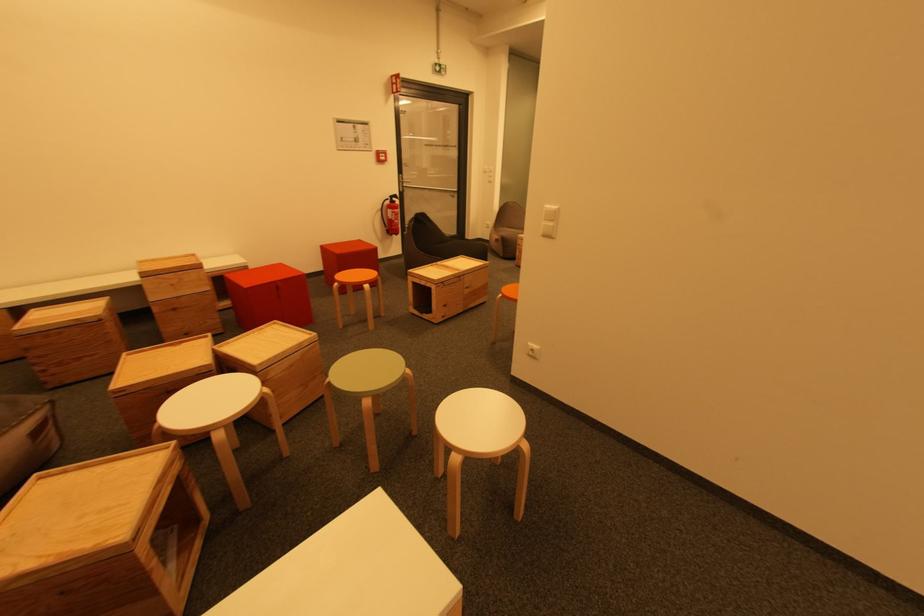
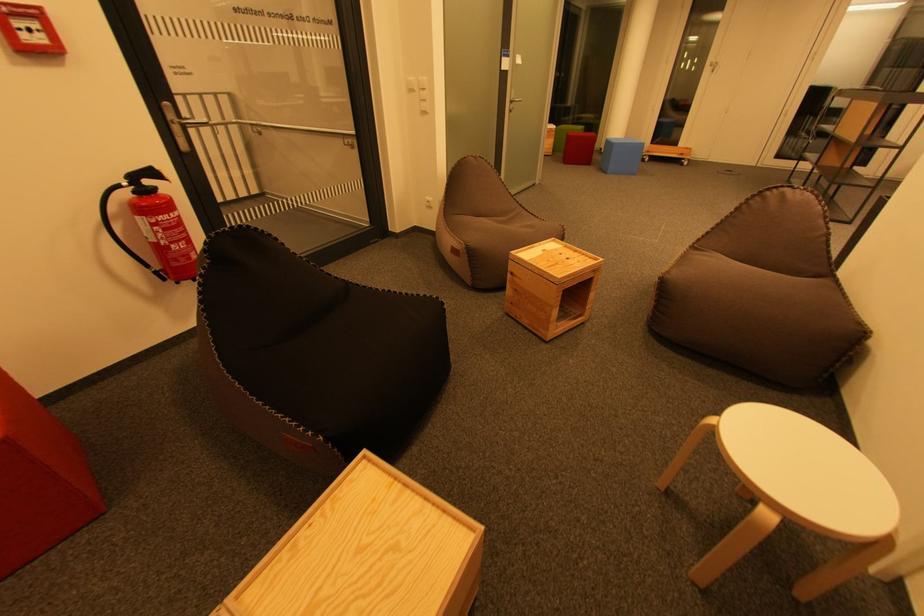
Question: The images are taken continuously from a first-person perspective. In which direction are you moving?

Choices:
 (A) Left
 (B) Right
 (C) Forward
 (D) Backward

Answer: (C)